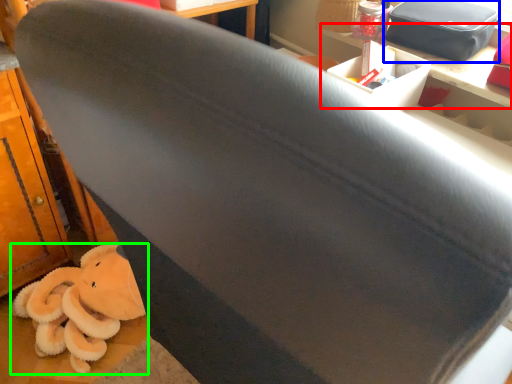
Question: Considering the real-world distances, which object is farthest from table (highlighted by a red box)? kit (highlighted by a blue box) or toy (highlighted by a green box)?

Choices:
 (A) kit
 (B) toy

Answer: (B)